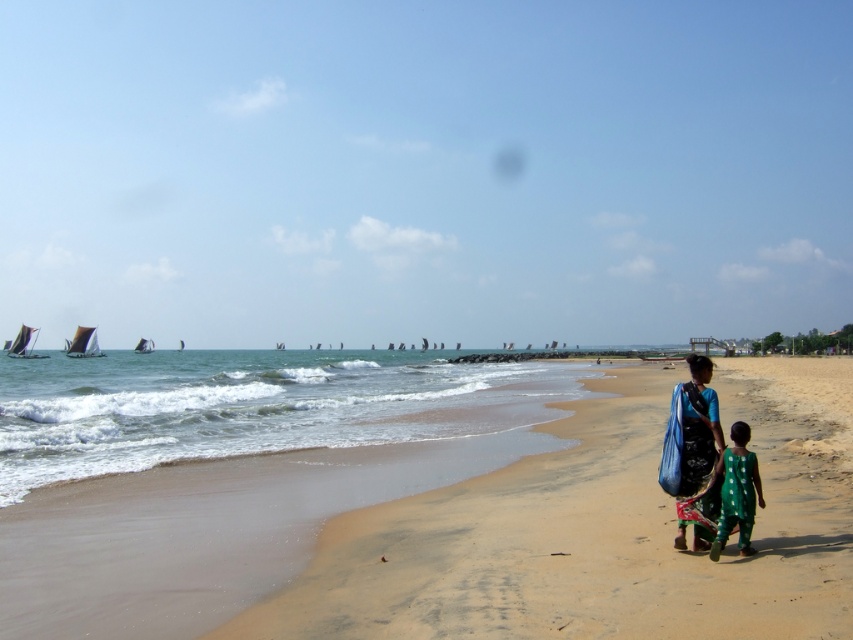
Between sandy beach at lower right and green dotted dress at lower right, which one is positioned lower?

sandy beach at lower right is lower down.

Is point (752, 580) positioned in front of point (743, 540)?

Yes, point (752, 580) is in front of point (743, 540).

Locate an element on the screen. sandy beach at lower right is located at coordinates click(599, 532).

Is sandy beach at lower right above blue fabric bag at center-right?

No, sandy beach at lower right is not above blue fabric bag at center-right.

Does point (525, 627) come closer to viewer compared to point (705, 499)?

That is True.

Who is more forward, [746,360] or [697,531]?

Point [697,531]

Locate an element on the screen. This screenshot has width=853, height=640. sandy beach at lower right is located at coordinates (599, 532).

Can you confirm if blue fabric bag at center-right is positioned above green dotted dress at lower right?

Indeed, blue fabric bag at center-right is positioned over green dotted dress at lower right.

Between blue fabric bag at center-right and green dotted dress at lower right, which one has less height?

green dotted dress at lower right

Between point (685, 436) and point (741, 452), which one is positioned behind?

Point (685, 436)

Locate an element on the screen. The image size is (853, 640). blue fabric bag at center-right is located at coordinates (698, 458).